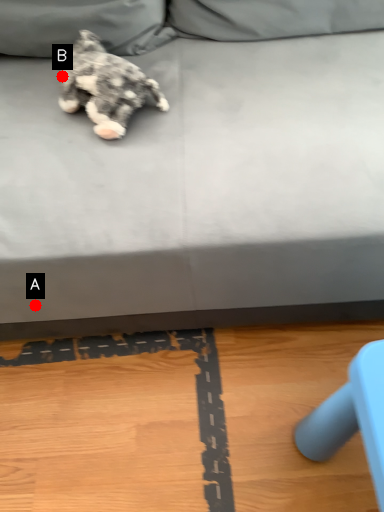
Question: Two points are circled on the image, labeled by A and B beside each circle. Which point is closer to the camera?

Choices:
 (A) A is closer
 (B) B is closer

Answer: (A)